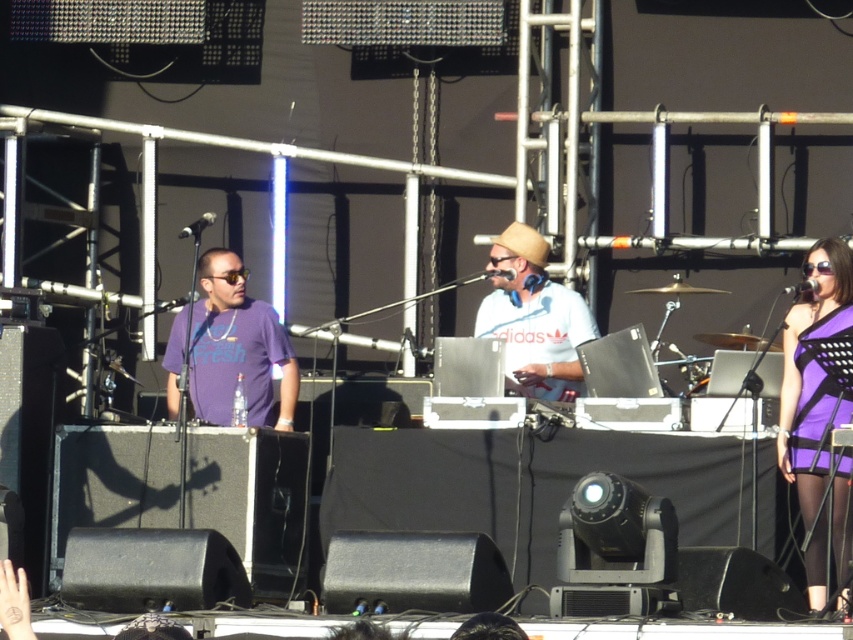
Question: Which of the following is the farthest from the observer?

Choices:
 (A) (840, 540)
 (B) (544, 365)
 (C) (167, 406)

Answer: (C)

Question: Can you confirm if purple mesh dress at right is positioned below white matte hat at center?

Choices:
 (A) yes
 (B) no

Answer: (A)

Question: In this image, where is purple mesh dress at right located relative to white matte hat at center?

Choices:
 (A) left
 (B) right

Answer: (B)

Question: Among these objects, which one is farthest from the camera?

Choices:
 (A) purple matte shirt at center
 (B) purple mesh dress at right
 (C) white matte hat at center

Answer: (A)

Question: Considering the real-world distances, which object is closest to the white matte hat at center?

Choices:
 (A) purple mesh dress at right
 (B) purple matte shirt at center

Answer: (B)

Question: Can you confirm if purple mesh dress at right is wider than white matte hat at center?

Choices:
 (A) no
 (B) yes

Answer: (A)